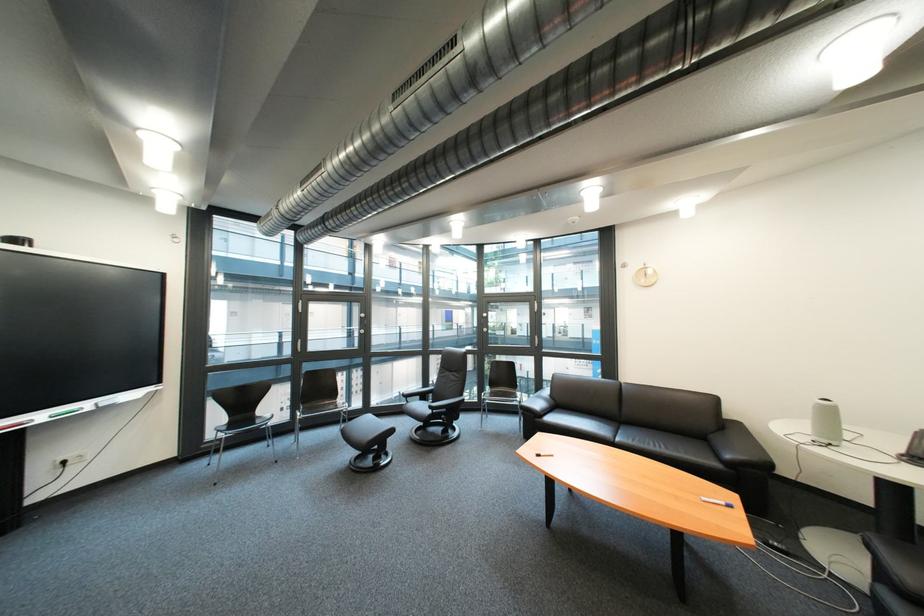
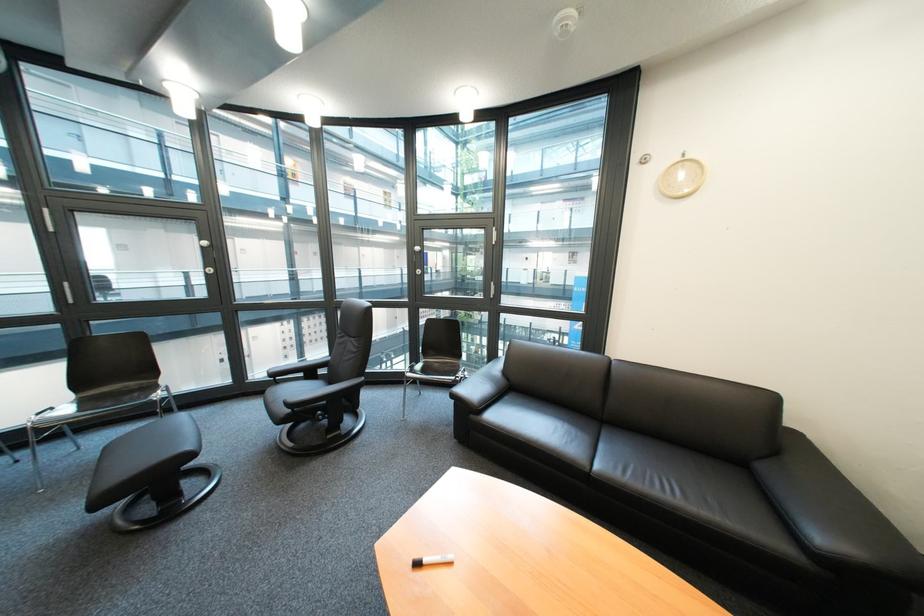
Locate, in the second image, the point that corresponds to the point at 742,458 in the first image.

(833, 540)